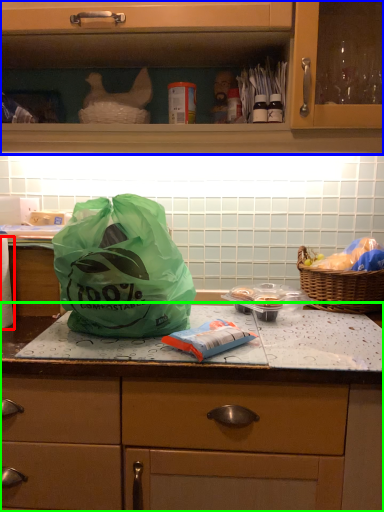
Question: Which is nearer to the toilet paper (highlighted by a red box)? cabinetry (highlighted by a blue box) or countertop (highlighted by a green box).

Choices:
 (A) cabinetry
 (B) countertop

Answer: (B)